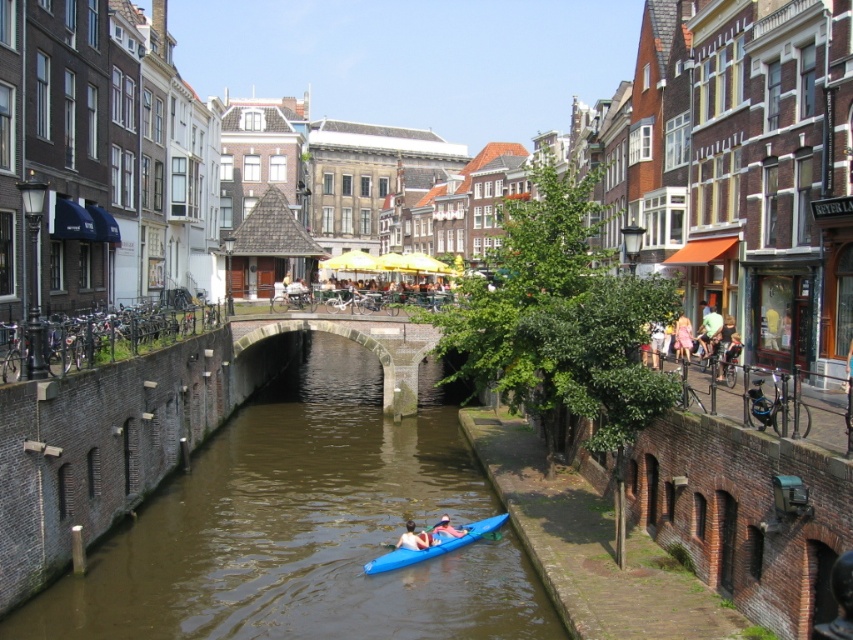
You are a photographer planning to capture the blue matte kayak at center and the light blue kayak at lower center in the same frame. Given their sizes, which kayak will appear larger in your photo?

The blue matte kayak at center will appear larger in the photo because it is bigger than the light blue kayak at lower center.